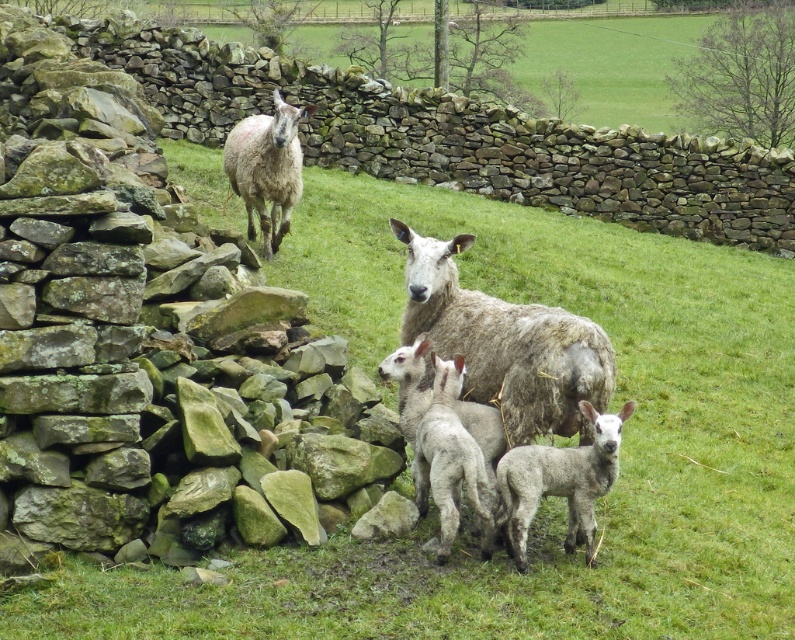
You are a farmer checking on your sheep in the field. You notice two lambs near the adult sheep. Which lamb is closer to the ground, the fuzzy white lamb at center or the gray woolen lamb at center?

The fuzzy white lamb at center is shorter than the gray woolen lamb at center, so the fuzzy white lamb at center is closer to the ground.

You are a photographer standing in front of the stone wall. You want to take a photo of both the fuzzy white lamb at center and the fuzzy white sheep at upper left. Which animal will appear larger in your photo?

The fuzzy white lamb at center will appear larger in the photo because it is closer to the viewer than the fuzzy white sheep at upper left.